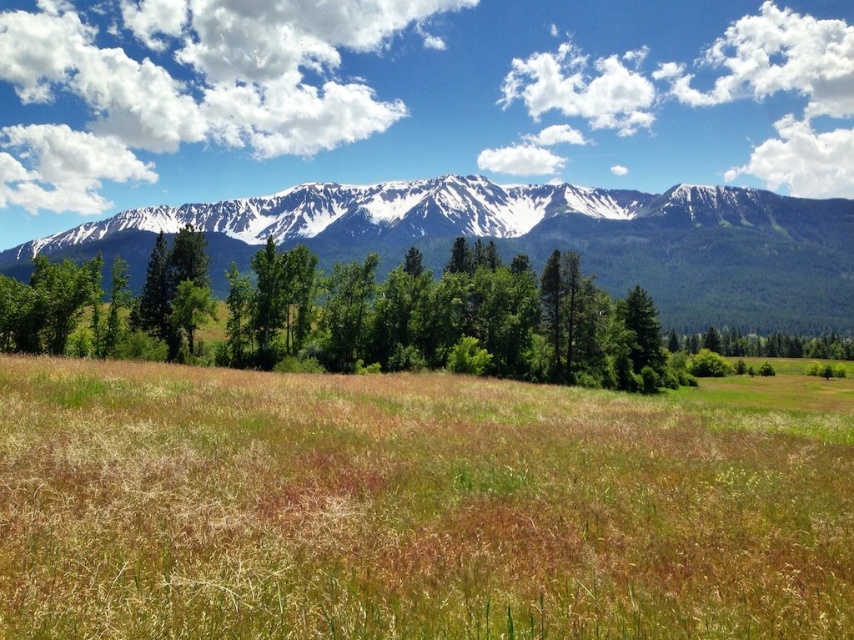
You are standing at the point marked by the coordinates point (416, 506) in the image. Based on the scene description, what type of terrain are you currently standing on?

The point (416, 506) indicates brown grassland at center, so you are standing on brown grassland terrain.

You are standing in the field of grass and want to walk towards the mountain range. There are two points marked on your map. Which point, point (451, 550) or point (850, 324), is closer to you?

Point (451, 550) is in front of point (850, 324), so it is closer to you.